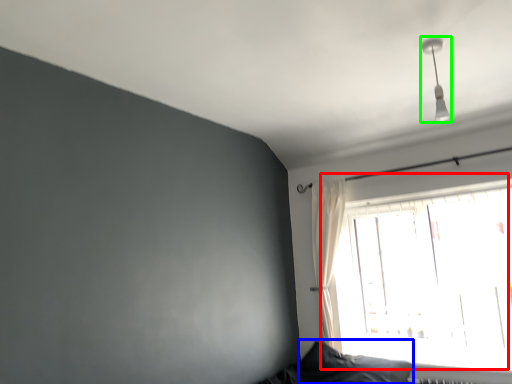
Question: Based on their relative distances, which object is farther from window (highlighted by a red box)? Choose from pillow (highlighted by a blue box) and fixture (highlighted by a green box).

Choices:
 (A) pillow
 (B) fixture

Answer: (B)